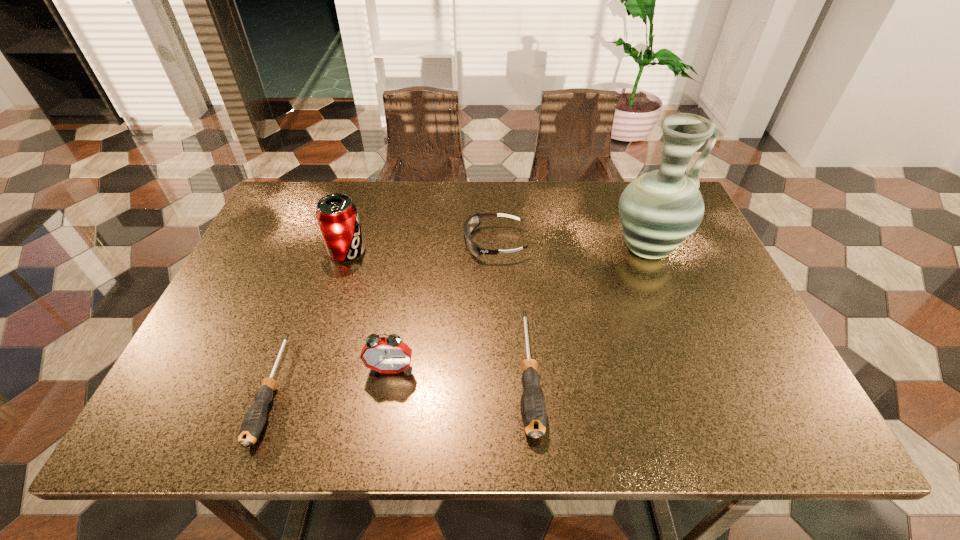
Image resolution: width=960 pixels, height=540 pixels. What are the coordinates of `free point that keeps the screwdrivers evenly spaced on the right` in the screenshot? It's located at (770, 357).